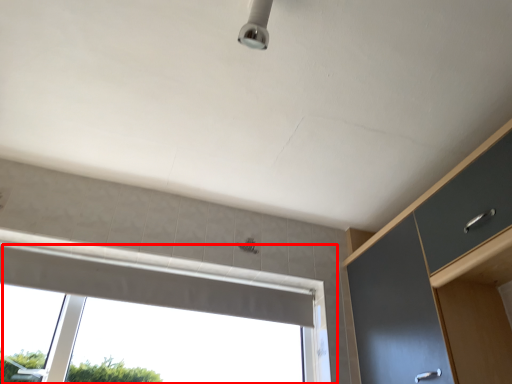
Question: Considering the relative positions of window (annotated by the red box) and dresser in the image provided, where is window (annotated by the red box) located with respect to the staircase?

Choices:
 (A) right
 (B) left

Answer: (B)